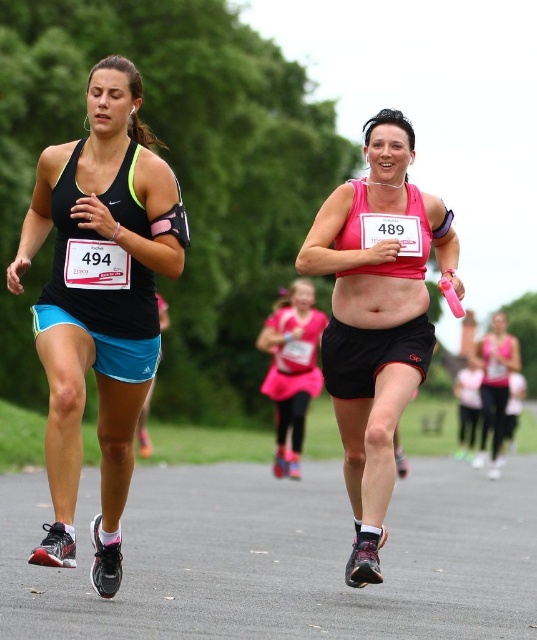
You are a race organizer and need to ensure that all runners are spaced at least 10 meters apart for safety. You observe the matte pink belly at center and the pink matte tank top at right. Are these two runners maintaining the required safety distance?

The distance between the matte pink belly at center and the pink matte tank top at right is 13.16 meters, which exceeds the minimum required 10 meters. Therefore, they are maintaining the required safety distance.

You are a photographer at the marathon event. You want to capture a photo of the pink fabric skirt at center and the pink matte tank top at right. Which one will appear closer to the camera in the photo?

The pink fabric skirt at center will appear closer to the camera because it is in front of the pink matte tank top at right.